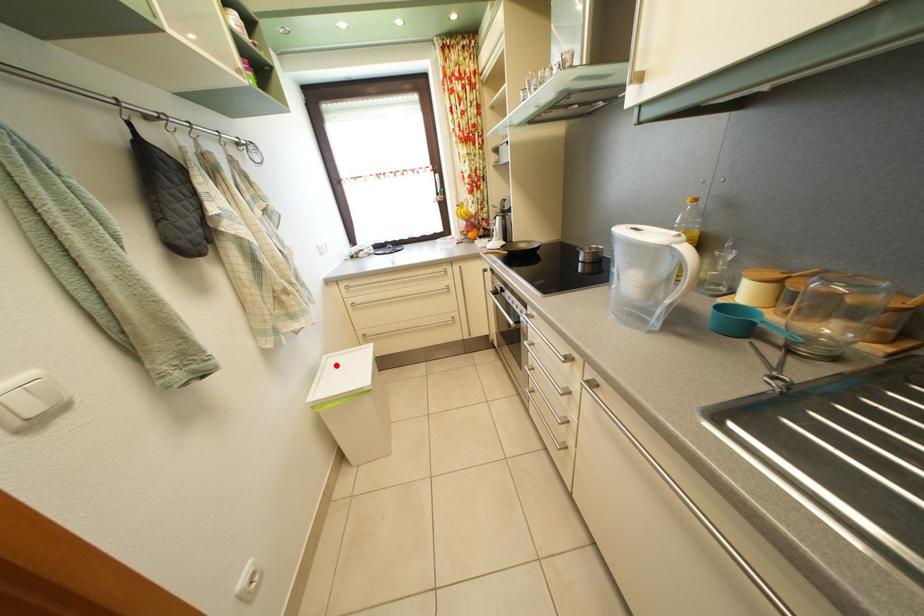
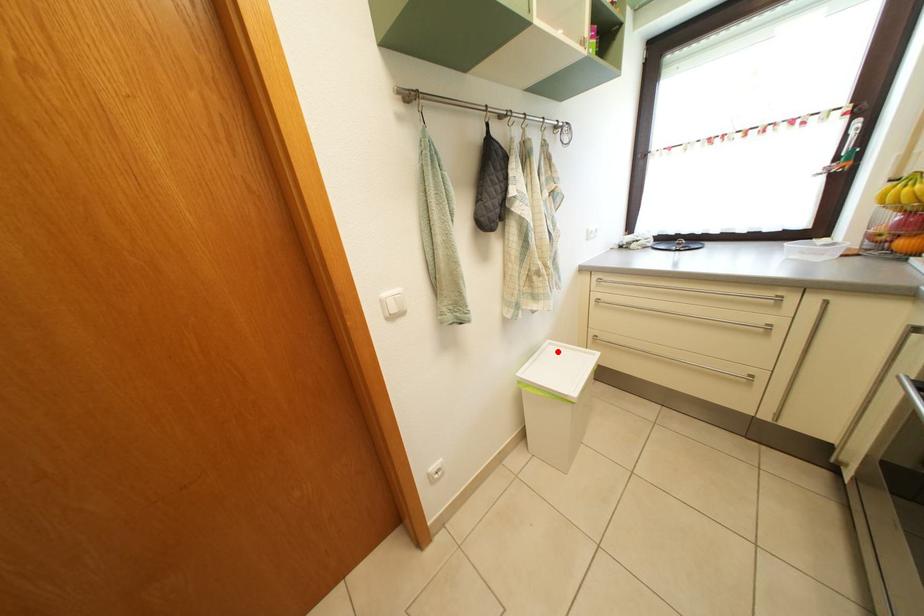
I am providing you with two images of the same scene from different viewpoints. A red point is marked on the first image and another point is marked on the second image. Does the point marked in image1 correspond to the same location as the one in image2?

Yes